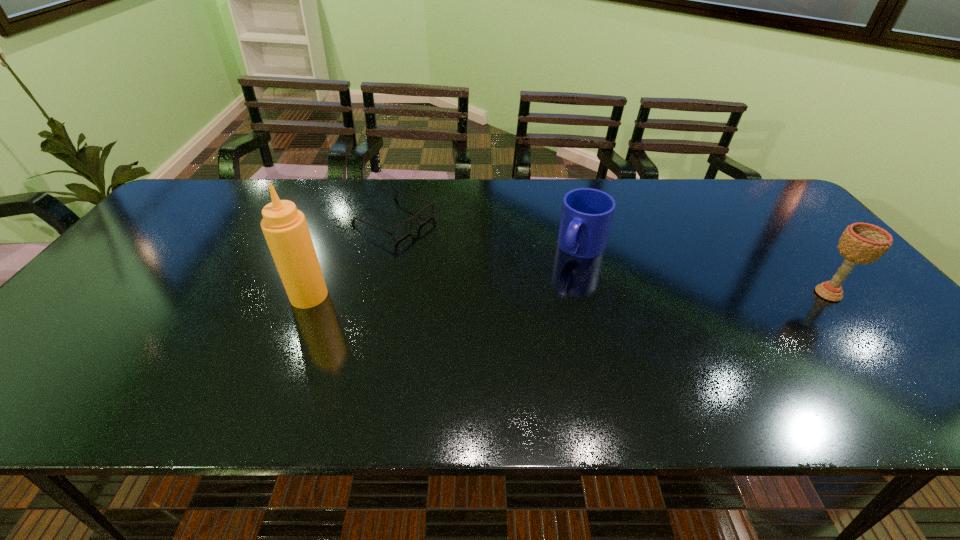
I want to click on vacant space on the desktop that is between the tallest object and the rightmost object and is positioned on the side with the handle of the second shortest object, so click(x=549, y=295).

Find the location of `vacant space on the desktop that is between the tallest object and the chalice and is positioned on the front-facing side of the spectacles`. vacant space on the desktop that is between the tallest object and the chalice and is positioned on the front-facing side of the spectacles is located at coordinates (561, 295).